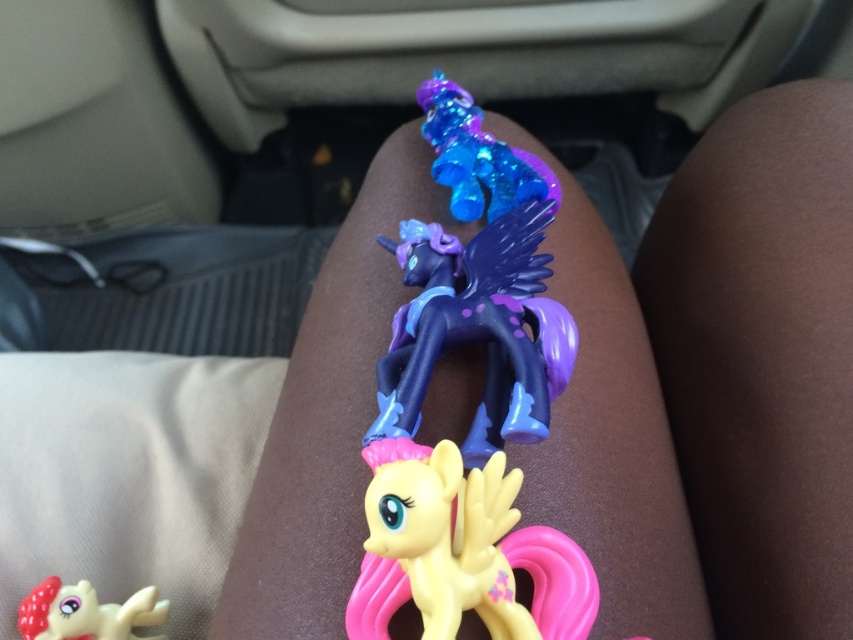
Between glossy plastic unicorn at center and shiny plastic pony at lower left, which one appears on the right side from the viewer's perspective?

Positioned to the right is glossy plastic unicorn at center.

From the picture: Which of these two, glossy plastic unicorn at center or shiny plastic pony at lower left, stands shorter?

With less height is shiny plastic pony at lower left.

Which is in front, point (480, 237) or point (114, 627)?

Positioned in front is point (114, 627).

This screenshot has height=640, width=853. What are the coordinates of `glossy plastic unicorn at center` in the screenshot? It's located at (477, 330).

Measure the distance between yellow matte plastic pony at center and camera.

yellow matte plastic pony at center is 26.00 inches from camera.

Between yellow matte plastic pony at center and glossy plastic unicorn at center, which one appears on the right side from the viewer's perspective?

yellow matte plastic pony at center is more to the right.

Is point (405, 472) positioned behind point (556, 369)?

That is False.

At what (x,y) coordinates should I click in order to perform the action: click on yellow matte plastic pony at center. Please return your answer as a coordinate pair (x, y). The height and width of the screenshot is (640, 853). Looking at the image, I should click on (461, 550).

Is point (404, 593) in front of point (77, 595)?

Yes, point (404, 593) is in front of point (77, 595).

Does yellow matte plastic pony at center have a larger size compared to shiny plastic pony at lower left?

Yes.

This screenshot has height=640, width=853. Describe the element at coordinates (461, 550) in the screenshot. I see `yellow matte plastic pony at center` at that location.

The height and width of the screenshot is (640, 853). Identify the location of yellow matte plastic pony at center. click(x=461, y=550).